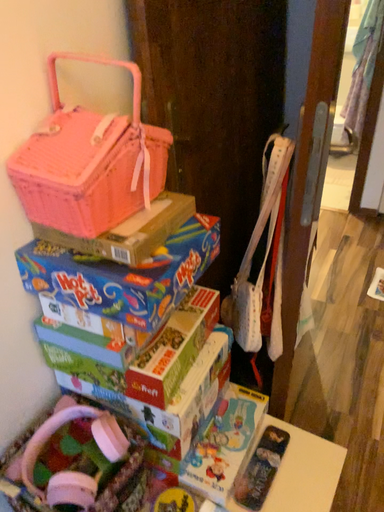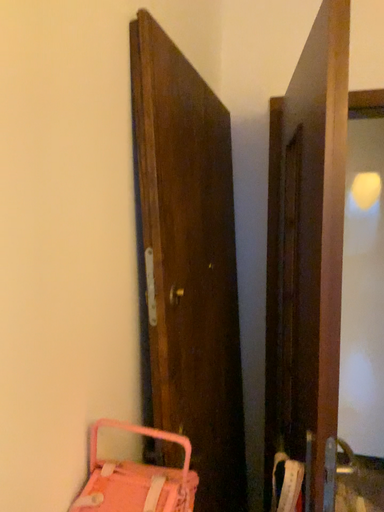
Question: How did the camera likely rotate when shooting the video?

Choices:
 (A) rotated left
 (B) rotated right

Answer: (B)